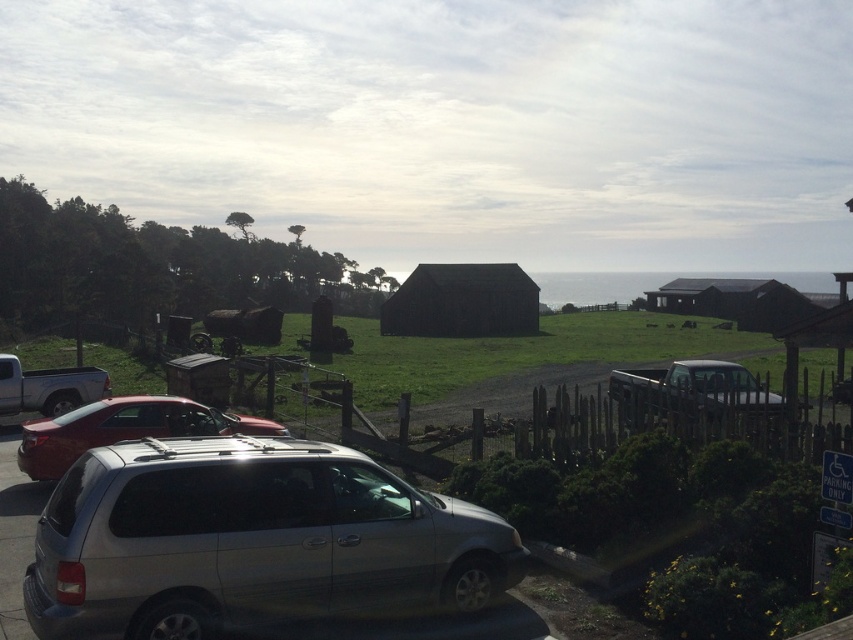
You are a visitor arriving at the parking area and want to park your car between the satin silver minivan at center and the black wooden hut at center. Based on the scene, can you determine which side of the minivan you should park on to be between them?

The satin silver minivan at center is to the left of the black wooden hut at center, so to park between them, you should position your car to the right of the satin silver minivan at center, closer to the black wooden hut at center.

You are standing at the entrance of the black wooden hut at center and want to walk to the silver metallic suv at lower left. Which direction should you head towards?

Since the black wooden hut at center is positioned over the silver metallic suv at lower left, you should head downward from the black wooden hut at center to reach the silver metallic suv at lower left.

You are a delivery driver who needs to park your truck in this parking area. You see the black wooden hut at center and the silver metallic suv at lower left. Which object is bigger in size so that you can use its space for parking?

The black wooden hut at center has a larger size compared to the silver metallic suv at lower left, so you can use the space around the black wooden hut at center for parking.